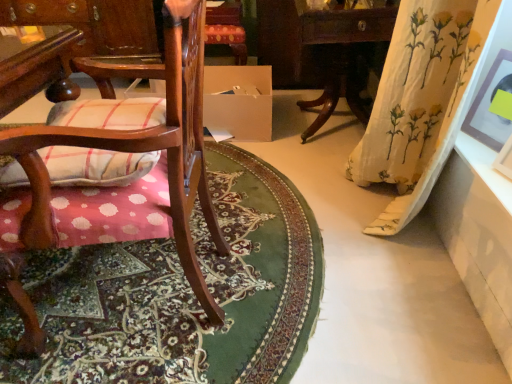
This screenshot has height=384, width=512. I want to click on vacant area that lies between wooden table at right, acting as the 2th table starting from the back, and white floral fabric curtain at right, so click(x=333, y=200).